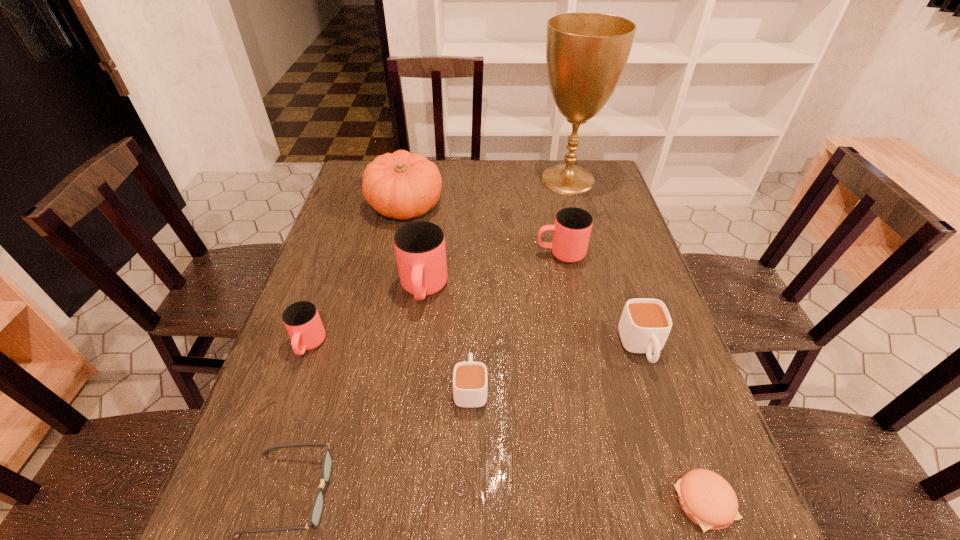
Find the location of `the fifth object from right to left`. the fifth object from right to left is located at coordinates (470, 384).

I want to click on the third cup from right to left, so click(x=470, y=384).

Find the location of a particular element. The height and width of the screenshot is (540, 960). gray spectacles is located at coordinates (x=317, y=507).

Find the location of a particular element. patty is located at coordinates (706, 498).

Where is `vacant region located 0.260m on the front of the trophy cup`? This screenshot has height=540, width=960. vacant region located 0.260m on the front of the trophy cup is located at coordinates [x=587, y=249].

Identify the location of free spot located on the back of the pumpkin. The image size is (960, 540). (412, 173).

At what (x,y) coordinates should I click in order to perform the action: click on free space located 0.200m on the handle side of the biggest pink cup. Please return your answer as a coordinate pair (x, y). The image size is (960, 540). Looking at the image, I should click on (411, 385).

This screenshot has width=960, height=540. I want to click on vacant region located on the handle side of the second smallest pink cup, so click(x=469, y=254).

I want to click on vacant region located 0.370m on the handle side of the second smallest pink cup, so click(x=407, y=254).

Find the location of a particular element. vacant position located on the handle side of the second smallest pink cup is located at coordinates (508, 254).